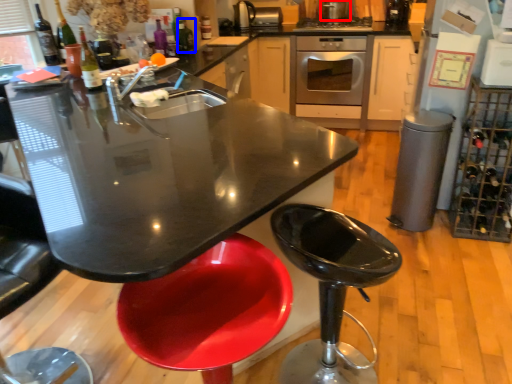
Question: Which of the following is the closest to the observer, appliance (highlighted by a red box) or wine bottle (highlighted by a blue box)?

Choices:
 (A) appliance
 (B) wine bottle

Answer: (B)